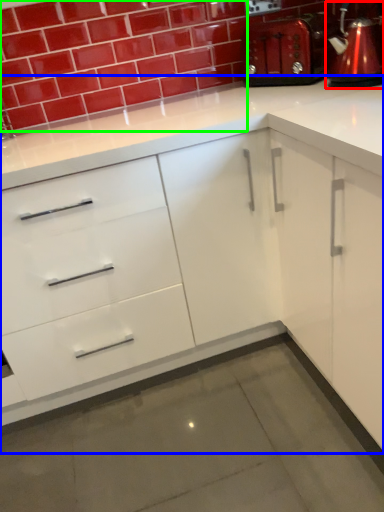
Question: Which object is the closest to the coffeepot (highlighted by a red box)? Choose among these: cabinetry (highlighted by a blue box) or brick (highlighted by a green box).

Choices:
 (A) cabinetry
 (B) brick

Answer: (A)